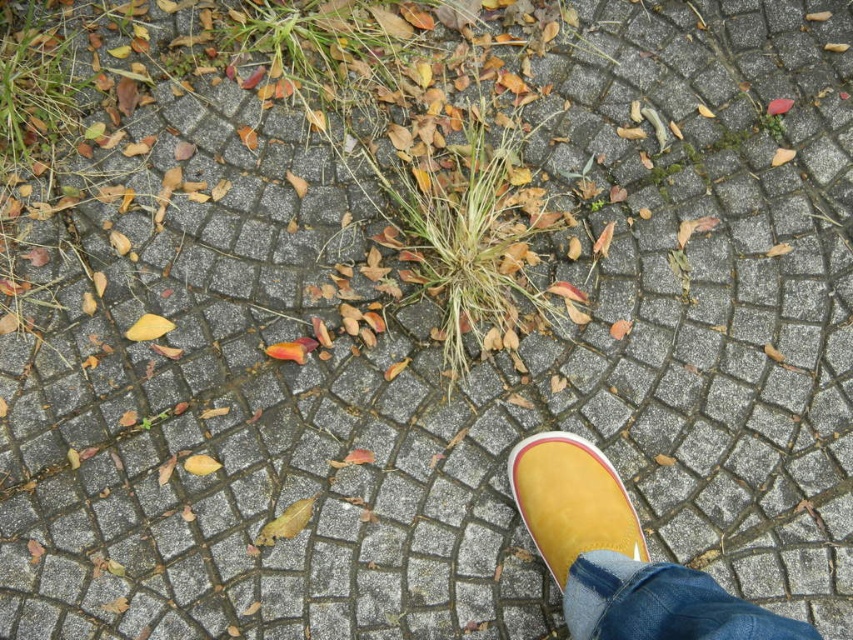
You are standing on the paved surface with interlocking gray concrete tiles and see the yellow rubber boot at lower right. Where is the yellow rubber boot located in relation to the grass growing through the cracks?

The yellow rubber boot at lower right is located at point (618, 556), which is near the lower right corner of the image, so it is positioned closer to the grass growing through the cracks between the paving stones.

You are standing on the paved walkway and notice two items at the lower right corner of your view. Which item is positioned more to the right between the denim at lower right and the yellow suede shoe at lower right?

The denim at lower right is positioned more to the right than the yellow suede shoe at lower right according to the description.